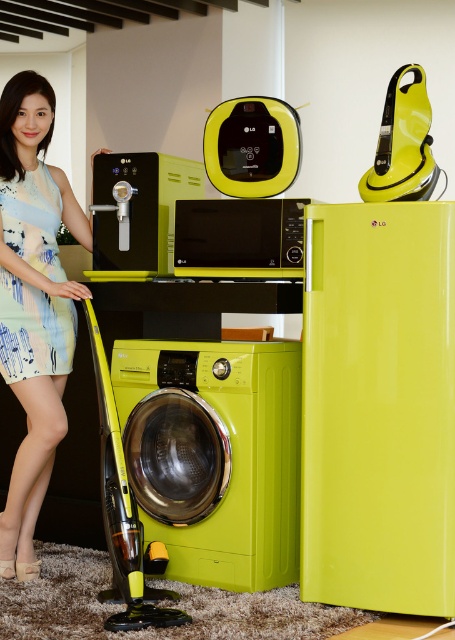
You are a delivery person who needs to place a small package on the glossy lime green washing machine at lower center. The package is 10 cm wide. The point at coordinate [215,456] is on the glossy lime green washing machine at lower center. Can you place the package there without it falling off?

The point at coordinate [215,456] is on the glossy lime green washing machine at lower center, so yes, the package can be placed there as it is a stable surface.

You are a customer in an appliance store looking at the glossy lime green washing machine at lower center and the glossy plastic washing machine at lower center. Which one is located to the right?

The glossy lime green washing machine at lower center is positioned on the right side of the glossy plastic washing machine at lower center, so it is located to the right.